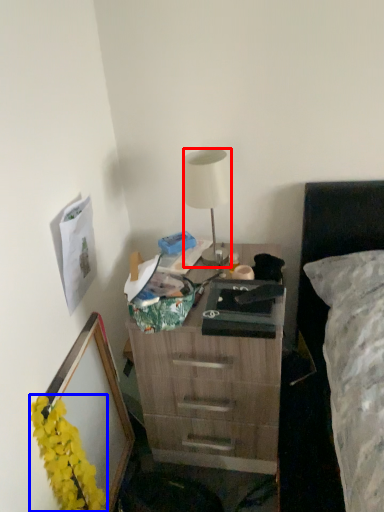
Question: Which of the following is the closest to the observer, lamp (highlighted by a red box) or flower (highlighted by a blue box)?

Choices:
 (A) lamp
 (B) flower

Answer: (B)